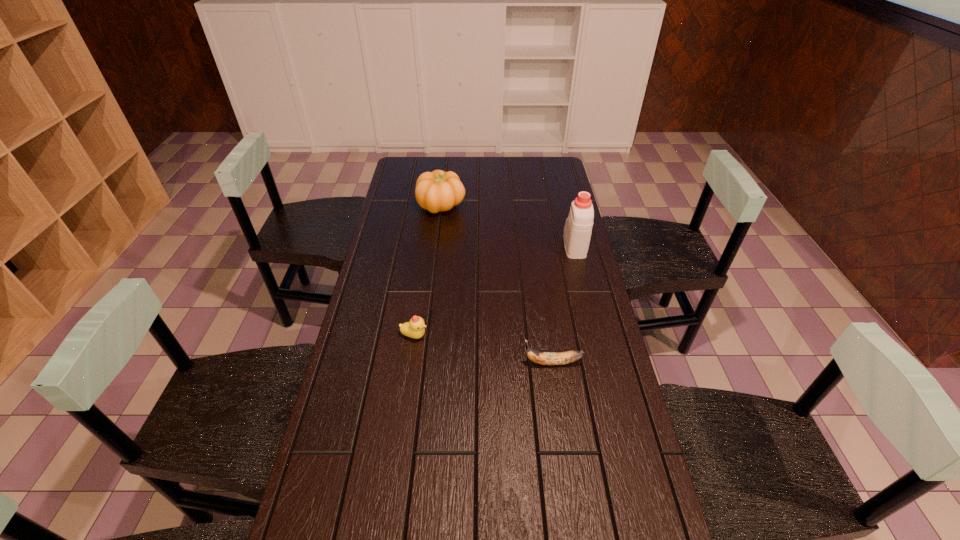
Locate an element on the screen. the second farthest object is located at coordinates (578, 227).

You are a GUI agent. You are given a task and a screenshot of the screen. Output one action in this format:
    pyautogui.click(x=<x>, y=<y>)
    Task: Click on the tallest object
    
    Given the screenshot: What is the action you would take?
    pyautogui.click(x=578, y=227)

At what (x,y) coordinates should I click in order to perform the action: click on the second tallest object. Please return your answer as a coordinate pair (x, y). Looking at the image, I should click on (435, 191).

The image size is (960, 540). Identify the location of pumpkin. (435, 191).

The image size is (960, 540). I want to click on the nearest object, so click(x=544, y=358).

Identify the location of banana. This screenshot has width=960, height=540. (544, 358).

What are the coordinates of `duckling` in the screenshot? It's located at (414, 328).

Find the location of a particular element. This screenshot has height=540, width=960. free region located on the handle side of the tallest object is located at coordinates (562, 195).

You are a GUI agent. You are given a task and a screenshot of the screen. Output one action in this format:
    pyautogui.click(x=<x>, y=<y>)
    Task: Click on the vacant space situated 0.340m on the handle side of the tallest object
    
    Given the screenshot: What is the action you would take?
    pyautogui.click(x=560, y=187)

What are the coordinates of `vacant space situated on the handle side of the tallest object` in the screenshot? It's located at (568, 220).